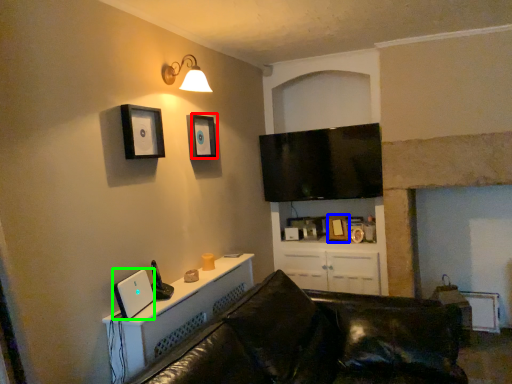
Question: Considering the real-world distances, which object is farthest from picture frame (highlighted by a red box)? picture frame (highlighted by a blue box) or desktop computer (highlighted by a green box)?

Choices:
 (A) picture frame
 (B) desktop computer

Answer: (A)